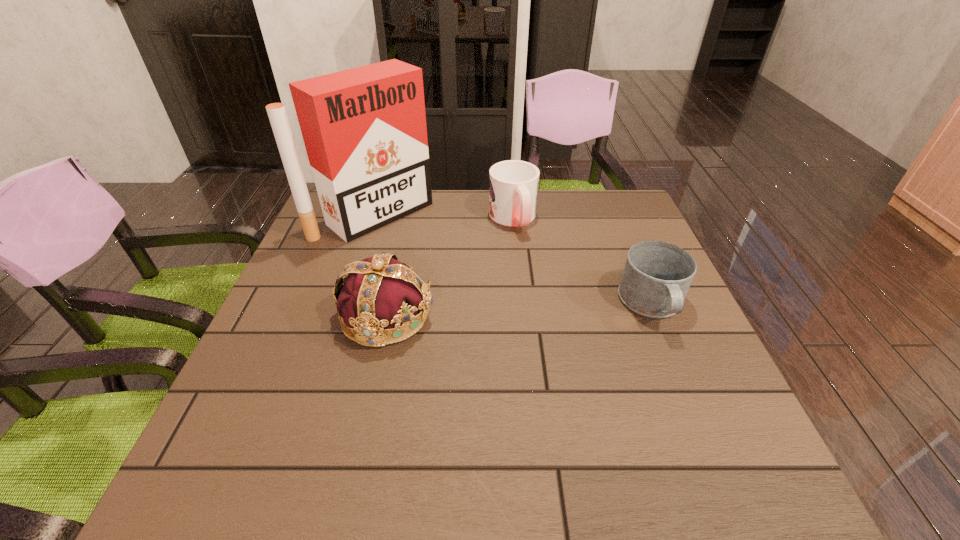
Where is `the third shortest object`? The height and width of the screenshot is (540, 960). the third shortest object is located at coordinates (379, 293).

What are the coordinates of `the rightmost object` in the screenshot? It's located at (657, 275).

Locate an element on the screen. the nearer mug is located at coordinates (657, 275).

Identify the location of the taller mug. This screenshot has height=540, width=960. (513, 184).

Locate an element on the screen. The width and height of the screenshot is (960, 540). the left mug is located at coordinates (513, 184).

Where is `the tallest object`? This screenshot has height=540, width=960. the tallest object is located at coordinates (364, 129).

Find the location of `vacant space located on the right of the third shortest object`. vacant space located on the right of the third shortest object is located at coordinates (489, 316).

Identify the location of vacant space located on the side of the rightmost object with the handle. (695, 406).

Image resolution: width=960 pixels, height=540 pixels. In order to click on free point located 0.200m on the side of the taller mug with the handle in this screenshot , I will do `click(543, 285)`.

Find the location of `vacant position located 0.160m on the side of the taller mug with the handle`. vacant position located 0.160m on the side of the taller mug with the handle is located at coordinates (539, 274).